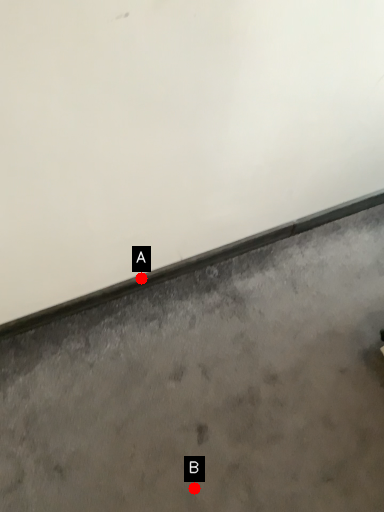
Question: Two points are circled on the image, labeled by A and B beside each circle. Which point is closer to the camera?

Choices:
 (A) A is closer
 (B) B is closer

Answer: (B)